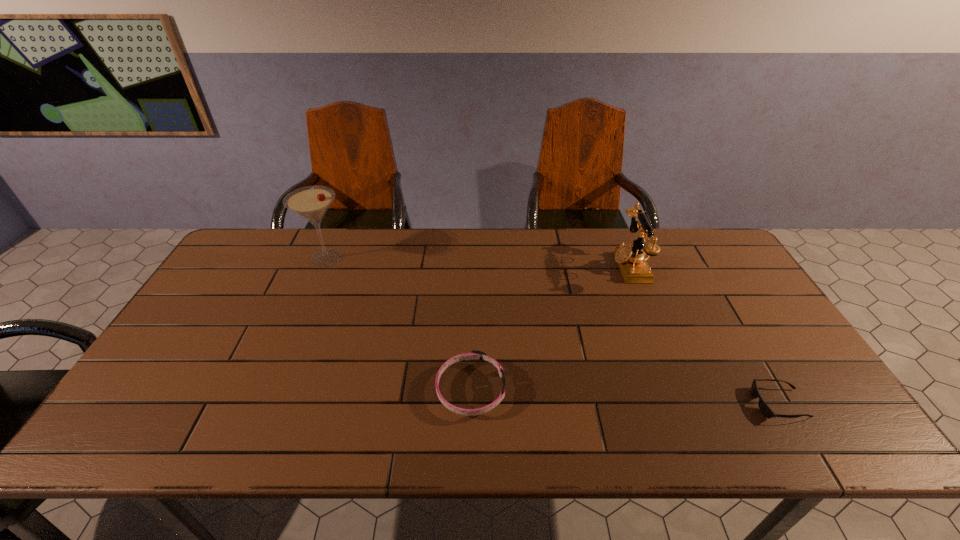
Identify the location of free space located 0.360m on the dial of the telephone. The image size is (960, 540). (502, 266).

At what (x,y) coordinates should I click in order to perform the action: click on vacant space situated 0.230m on the dial of the telephone. Please return your answer as a coordinate pair (x, y). This screenshot has width=960, height=540. Looking at the image, I should click on click(542, 266).

What are the coordinates of `vacant space situated 0.120m with the buckle on the second shortest object` in the screenshot? It's located at (555, 389).

Locate an element on the screen. The width and height of the screenshot is (960, 540). free spot located 0.250m on the front-facing side of the sunglasses is located at coordinates (649, 403).

Locate an element on the screen. The height and width of the screenshot is (540, 960). blank area located on the front-facing side of the sunglasses is located at coordinates (695, 403).

Locate an element on the screen. The width and height of the screenshot is (960, 540). free space located 0.120m on the front-facing side of the sunglasses is located at coordinates (704, 403).

Find the location of `martini located in the far edge section of the desktop`. martini located in the far edge section of the desktop is located at coordinates (310, 202).

You are a GUI agent. You are given a task and a screenshot of the screen. Output one action in this format:
    pyautogui.click(x=<x>, y=<y>)
    Task: Click on the telephone that is positioned at the far edge
    This screenshot has height=540, width=960.
    Given the screenshot: What is the action you would take?
    pyautogui.click(x=634, y=267)

Where is `dog collar located at the near edge`? The height and width of the screenshot is (540, 960). dog collar located at the near edge is located at coordinates (474, 355).

What are the coordinates of `sunglasses positioned at the near edge` in the screenshot? It's located at (764, 408).